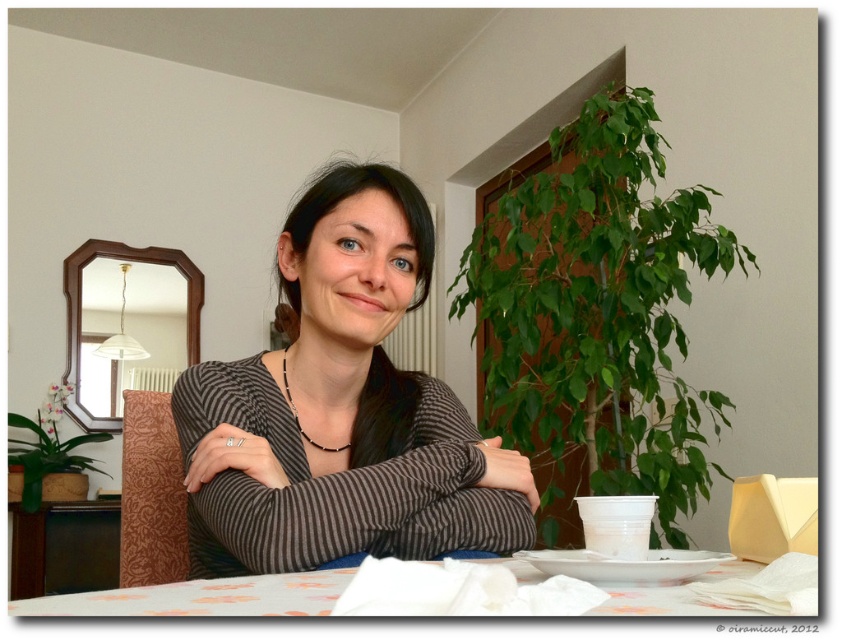
Does brown striped sweater at center have a smaller size compared to white glossy plate at lower center?

Incorrect, brown striped sweater at center is not smaller in size than white glossy plate at lower center.

Based on the photo, does brown striped sweater at center have a lesser height compared to white glossy plate at lower center?

In fact, brown striped sweater at center may be taller than white glossy plate at lower center.

Who is more distant from viewer, [214,452] or [717,560]?

Point [214,452]

Where is `brown striped sweater at center`? brown striped sweater at center is located at coordinates (340, 410).

Can you confirm if brown striped sweater at center is positioned above white fabric table at lower center?

Yes, brown striped sweater at center is above white fabric table at lower center.

Locate an element on the screen. This screenshot has width=842, height=640. brown striped sweater at center is located at coordinates (340, 410).

Who is positioned more to the left, white fabric table at lower center or white glossy plate at lower center?

white fabric table at lower center is more to the left.

Which is behind, point (717, 577) or point (569, 572)?

The point (717, 577) is more distant.

Is point (677, 586) behind point (534, 552)?

No.

This screenshot has height=640, width=842. What are the coordinates of `white fabric table at lower center` in the screenshot? It's located at (201, 596).